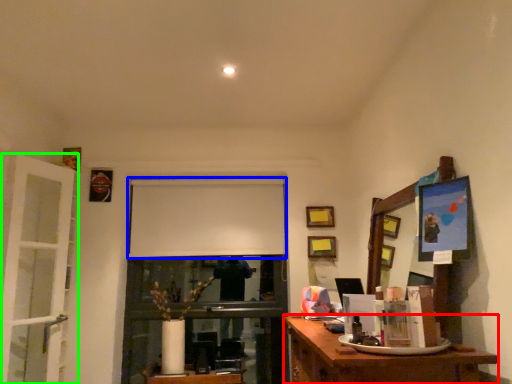
Question: Which object is positioned closest to desk (highlighted by a red box)? Select from projection screen (highlighted by a blue box) and door (highlighted by a green box).

Choices:
 (A) projection screen
 (B) door

Answer: (A)